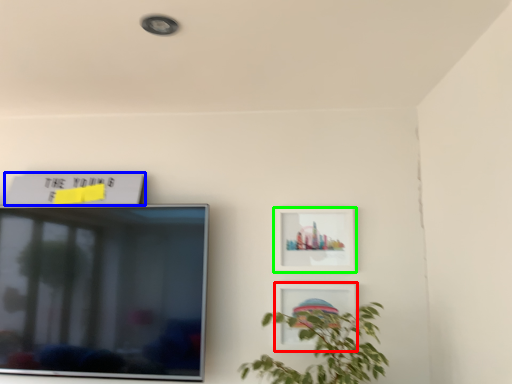
Question: Based on their relative distances, which object is farther from picture frame (highlighted by a red box)? Choose from picture frame (highlighted by a blue box) and picture frame (highlighted by a green box).

Choices:
 (A) picture frame
 (B) picture frame

Answer: (A)